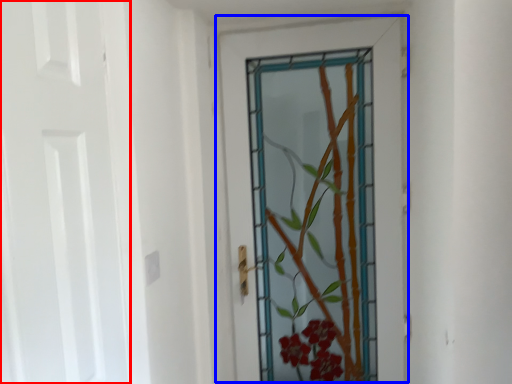
Question: Which point is further to the camera, door (highlighted by a red box) or door (highlighted by a blue box)?

Choices:
 (A) door
 (B) door

Answer: (B)